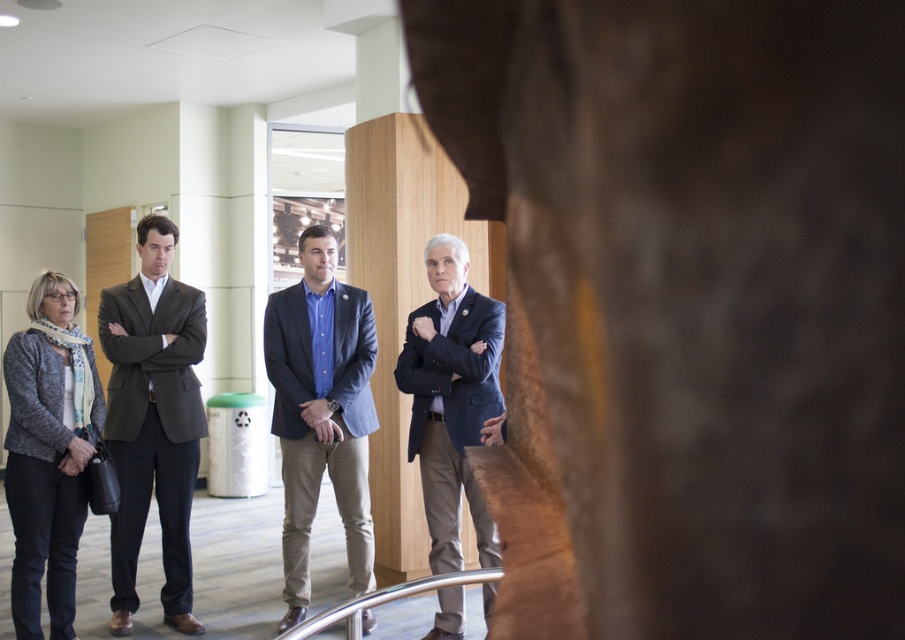
Can you confirm if matte blue shirt at center is positioned to the right of dark blue fabric business suit at center?

Incorrect, matte blue shirt at center is not on the right side of dark blue fabric business suit at center.

The width and height of the screenshot is (905, 640). Describe the element at coordinates (321, 410) in the screenshot. I see `matte blue shirt at center` at that location.

The height and width of the screenshot is (640, 905). I want to click on matte blue shirt at center, so click(321, 410).

Which is more to the right, matte black suit at left or dark blue fabric business suit at center?

dark blue fabric business suit at center

Based on the photo, between matte black suit at left and dark blue fabric business suit at center, which one is positioned higher?

matte black suit at left is above.

Find the location of a particular element. matte black suit at left is located at coordinates (153, 419).

Between matte black suit at left and matte blue shirt at center, which one is positioned lower?

matte blue shirt at center

Consider the image. Does matte black suit at left have a greater width compared to matte blue shirt at center?

No.

Which is in front, point (113, 460) or point (317, 296)?

Point (113, 460) is in front.

The height and width of the screenshot is (640, 905). In order to click on matte black suit at left in this screenshot , I will do click(153, 419).